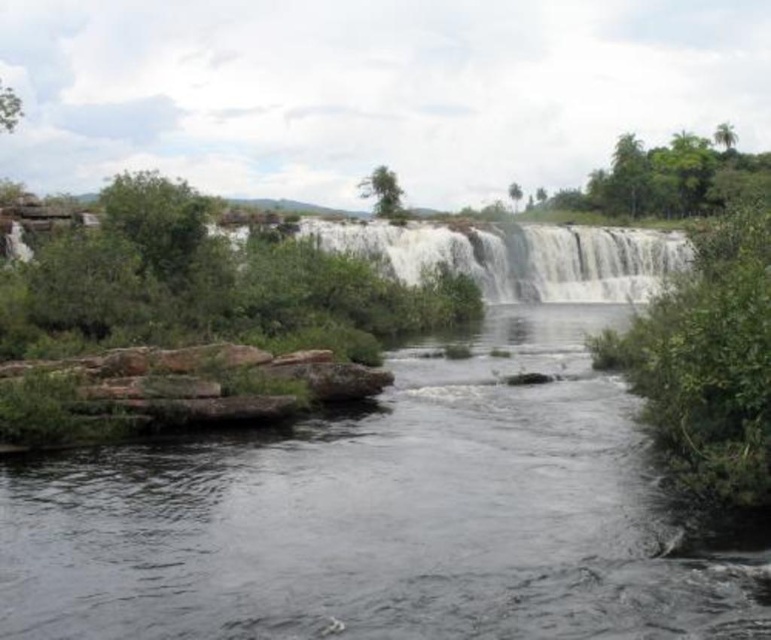
Question: Is the position of clear water at center less distant than that of white textured water at center?

Choices:
 (A) no
 (B) yes

Answer: (B)

Question: From the image, what is the correct spatial relationship of clear water at center in relation to white textured water at center?

Choices:
 (A) right
 (B) left

Answer: (B)

Question: Which point appears farthest from the camera in this image?

Choices:
 (A) (322, 230)
 (B) (29, 524)

Answer: (A)

Question: Which object appears closest to the camera in this image?

Choices:
 (A) clear water at center
 (B) white textured water at center

Answer: (A)

Question: Does clear water at center come in front of white textured water at center?

Choices:
 (A) yes
 (B) no

Answer: (A)